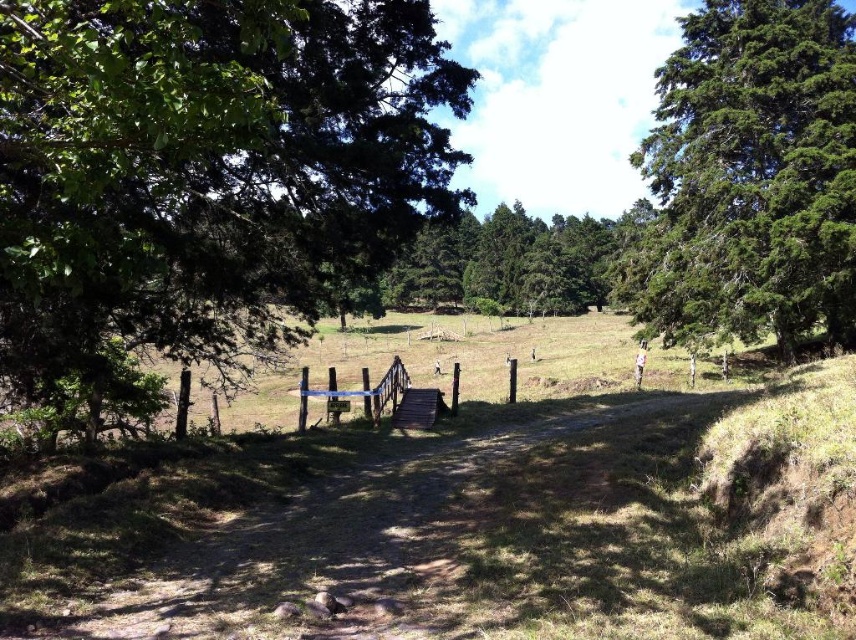
Which is more to the right, green leafy tree at left or green textured tree at right?

green textured tree at right is more to the right.

Which of these two, green leafy tree at left or green textured tree at right, stands shorter?

Standing shorter between the two is green leafy tree at left.

Is point (366, 3) less distant than point (690, 248)?

Yes, it is.

I want to click on green leafy tree at left, so click(x=207, y=168).

Between green leafy tree at left and dirt path at center, which one appears on the right side from the viewer's perspective?

dirt path at center is more to the right.

Can you confirm if green leafy tree at left is positioned to the right of dirt path at center?

In fact, green leafy tree at left is to the left of dirt path at center.

Locate an element on the screen. The image size is (856, 640). green leafy tree at left is located at coordinates (207, 168).

Can you confirm if dirt path at center is positioned to the right of green textured tree at right?

Incorrect, dirt path at center is not on the right side of green textured tree at right.

Is dirt path at center shorter than green textured tree at right?

Indeed, dirt path at center has a lesser height compared to green textured tree at right.

At what (x,y) coordinates should I click in order to perform the action: click on dirt path at center. Please return your answer as a coordinate pair (x, y). This screenshot has height=640, width=856. Looking at the image, I should click on (403, 531).